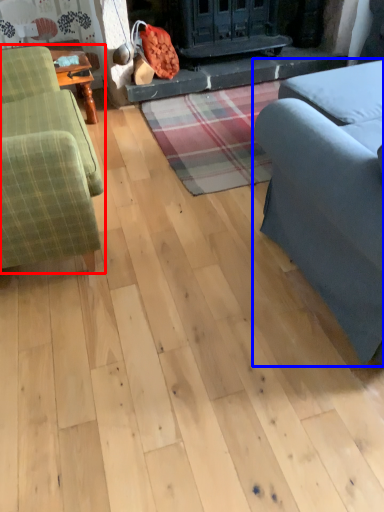
Question: Among these objects, which one is nearest to the camera, studio couch (highlighted by a red box) or studio couch (highlighted by a blue box)?

Choices:
 (A) studio couch
 (B) studio couch

Answer: (B)